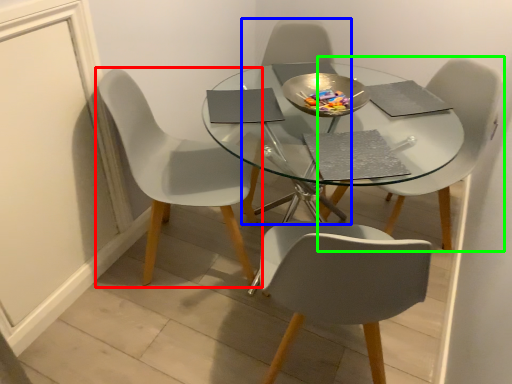
Question: Considering the real-world distances, which object is closest to chair (highlighted by a red box)? chair (highlighted by a blue box) or chair (highlighted by a green box).

Choices:
 (A) chair
 (B) chair

Answer: (A)